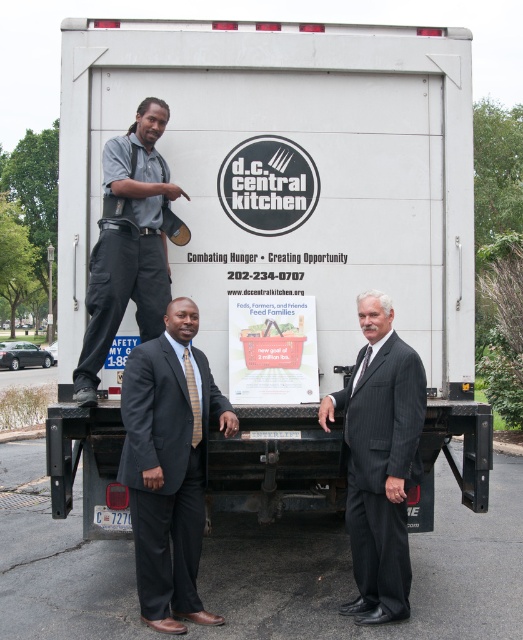
Question: Which point is farther to the camera?

Choices:
 (A) (164, 429)
 (B) (350, 432)
 (C) (310, 321)
 (D) (137, 248)

Answer: (C)

Question: Considering the real-world distances, which object is farthest from the pinstripe suit at center?

Choices:
 (A) white matte trailer truck at center
 (B) gray uniform at center

Answer: (B)

Question: Does dark gray suit at center appear on the right side of gray uniform at center?

Choices:
 (A) yes
 (B) no

Answer: (A)

Question: In this image, where is dark gray suit at center located relative to pinstripe suit at center?

Choices:
 (A) above
 (B) below

Answer: (B)

Question: Where is dark gray suit at center located in relation to gray uniform at center in the image?

Choices:
 (A) below
 (B) above

Answer: (A)

Question: Which object is the farthest from the dark gray suit at center?

Choices:
 (A) gray uniform at center
 (B) white matte trailer truck at center

Answer: (B)